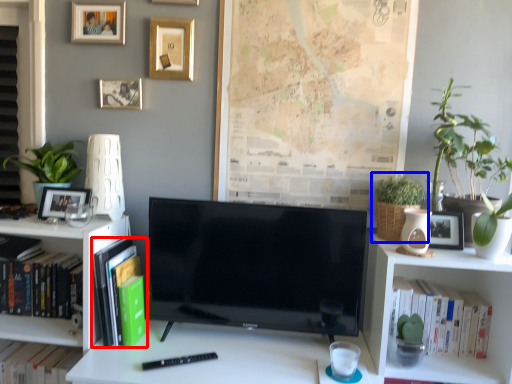
Question: Which object is closer to the camera taking this photo, book (highlighted by a red box) or houseplant (highlighted by a blue box)?

Choices:
 (A) book
 (B) houseplant

Answer: (A)